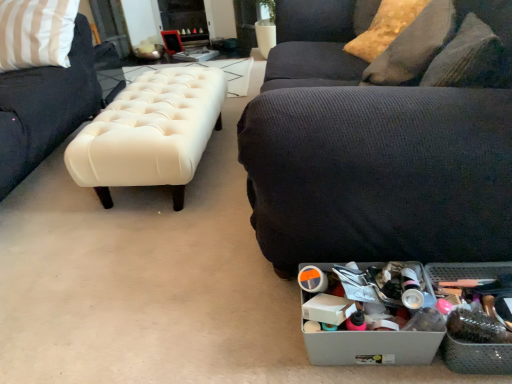
What do you see at coordinates (371, 347) in the screenshot? This screenshot has width=512, height=384. I see `metallic gray storage box at lower right, which is the second storage box in right-to-left order` at bounding box center [371, 347].

In order to click on metallic gray storage box at lower right, which is the second storage box in right-to-left order in this screenshot , I will do `click(371, 347)`.

The image size is (512, 384). Describe the element at coordinates (382, 138) in the screenshot. I see `dark gray textured couch at lower right` at that location.

The image size is (512, 384). I want to click on textured yellow pillow at upper right, which appears as the 2th pillow when viewed from the top, so click(x=414, y=46).

This screenshot has width=512, height=384. I want to click on creamy leather bench at center, so click(x=150, y=133).

Where is `metallic gray storage box at lower right, which is the 2th storage box from left to right`? metallic gray storage box at lower right, which is the 2th storage box from left to right is located at coordinates (477, 357).

Is point (374, 32) farther from camera compared to point (457, 275)?

Yes, it is.

Looking at this image, how distant is shiny gold pillow at upper right, which is the first pillow from top to bottom, from metallic gray storage box at lower right, the 1th storage box when ordered from right to left?

A distance of 4.33 feet exists between shiny gold pillow at upper right, which is the first pillow from top to bottom, and metallic gray storage box at lower right, the 1th storage box when ordered from right to left.

From a real-world perspective, is shiny gold pillow at upper right, which is the first pillow from top to bottom, physically located above or below metallic gray storage box at lower right, which is the 2th storage box from left to right?

shiny gold pillow at upper right, which is the first pillow from top to bottom, is above metallic gray storage box at lower right, which is the 2th storage box from left to right.

In the scene shown: Considering the relative positions of shiny gold pillow at upper right, which is the first pillow from top to bottom, and metallic gray storage box at lower right, which is the 2th storage box from left to right, in the image provided, is shiny gold pillow at upper right, which is the first pillow from top to bottom, behind metallic gray storage box at lower right, which is the 2th storage box from left to right,?

Yes, shiny gold pillow at upper right, which is the first pillow from top to bottom, is further from the viewer.

In the scene shown: How many degrees apart are the facing directions of metallic gray storage box at lower right, which is counted as the first storage box, starting from the left, and creamy leather bench at center?

metallic gray storage box at lower right, which is counted as the first storage box, starting from the left, and creamy leather bench at center are facing 3.21 degrees away from each other.

Is metallic gray storage box at lower right, which is counted as the first storage box, starting from the left, positioned with its back to creamy leather bench at center?

No, creamy leather bench at center is not at the back of metallic gray storage box at lower right, which is counted as the first storage box, starting from the left.

From the image's perspective, count 2nd storage boxs downward from the creamy leather bench at center and point to it. Please provide its 2D coordinates.

[(371, 347)]

Can you confirm if metallic gray storage box at lower right, which is counted as the first storage box, starting from the left, is bigger than creamy leather bench at center?

No.

Is shiny gold pillow at upper right, the second pillow ordered from the bottom, oriented away from dark gray textured couch at lower right?

Yes, shiny gold pillow at upper right, the second pillow ordered from the bottom, is positioned with its back facing dark gray textured couch at lower right.

Where is `studio couch that is under the shiny gold pillow at upper right, which is the first pillow from top to bottom (from a real-world perspective)`? This screenshot has width=512, height=384. studio couch that is under the shiny gold pillow at upper right, which is the first pillow from top to bottom (from a real-world perspective) is located at coordinates (x=382, y=138).

Considering the positions of point (370, 57) and point (378, 113), is point (370, 57) closer or farther from the camera than point (378, 113)?

Point (370, 57) is positioned farther from the camera compared to point (378, 113).

Is dark gray textured couch at lower right aimed at shiny gold pillow at upper right, which is the first pillow from top to bottom?

Yes.

Is dark gray textured couch at lower right not within shiny gold pillow at upper right, which is the first pillow from top to bottom?

dark gray textured couch at lower right lies outside shiny gold pillow at upper right, which is the first pillow from top to bottom,'s area.

From the image's perspective, which one is positioned lower, dark gray textured couch at lower right or shiny gold pillow at upper right, which is the first pillow from top to bottom?

dark gray textured couch at lower right, from the image's perspective.

From the image's perspective, which object appears higher, creamy leather bench at center or shiny gold pillow at upper right, which is the first pillow from top to bottom?

From the image's view, shiny gold pillow at upper right, which is the first pillow from top to bottom, is above.

Consider the image. Considering the sizes of creamy leather bench at center and shiny gold pillow at upper right, which is the first pillow from top to bottom, in the image, is creamy leather bench at center bigger or smaller than shiny gold pillow at upper right, which is the first pillow from top to bottom,?

In the image, creamy leather bench at center appears to be larger than shiny gold pillow at upper right, which is the first pillow from top to bottom.

Who is more distant, creamy leather bench at center or shiny gold pillow at upper right, which is the first pillow from top to bottom?

shiny gold pillow at upper right, which is the first pillow from top to bottom, is behind.

Is metallic gray storage box at lower right, which is counted as the first storage box, starting from the left, in front of or behind shiny gold pillow at upper right, the second pillow ordered from the bottom, in the image?

Clearly, metallic gray storage box at lower right, which is counted as the first storage box, starting from the left, is in front of shiny gold pillow at upper right, the second pillow ordered from the bottom.

Is shiny gold pillow at upper right, which is the first pillow from top to bottom, inside metallic gray storage box at lower right, which is counted as the first storage box, starting from the left?

Definitely not — shiny gold pillow at upper right, which is the first pillow from top to bottom, is not inside metallic gray storage box at lower right, which is counted as the first storage box, starting from the left.

Can you confirm if metallic gray storage box at lower right, which is counted as the first storage box, starting from the left, is positioned to the right of shiny gold pillow at upper right, the second pillow ordered from the bottom?

No.

From the image's perspective, is metallic gray storage box at lower right, which is counted as the first storage box, starting from the left, over shiny gold pillow at upper right, the second pillow ordered from the bottom?

No, from the image's perspective, metallic gray storage box at lower right, which is counted as the first storage box, starting from the left, is not on top of shiny gold pillow at upper right, the second pillow ordered from the bottom.

From the image's perspective, between shiny gold pillow at upper right, which is the first pillow from top to bottom, and textured yellow pillow at upper right, which appears as the 2th pillow when viewed from the top, which one is located above?

shiny gold pillow at upper right, which is the first pillow from top to bottom, is shown above in the image.

Is textured yellow pillow at upper right, which appears as the 2th pillow when viewed from the top, at the back of shiny gold pillow at upper right, which is the first pillow from top to bottom?

Yes, shiny gold pillow at upper right, which is the first pillow from top to bottom, is positioned with its back facing textured yellow pillow at upper right, which appears as the 2th pillow when viewed from the top.

You are a GUI agent. You are given a task and a screenshot of the screen. Output one action in this format:
    pyautogui.click(x=<x>, y=<y>)
    Task: Click on the pillow in front of the shiny gold pillow at upper right, which is the first pillow from top to bottom
    The height and width of the screenshot is (384, 512).
    Given the screenshot: What is the action you would take?
    pyautogui.click(x=414, y=46)

Is point (394, 14) positioned in front of point (424, 40)?

No, it is not.

Locate an element on the screen. This screenshot has height=384, width=512. the 1st storage box below when counting from the shiny gold pillow at upper right, the second pillow ordered from the bottom (from the image's perspective) is located at coordinates (477, 357).

This screenshot has width=512, height=384. Find the location of `table to the left of metallic gray storage box at lower right, which is counted as the first storage box, starting from the left`. table to the left of metallic gray storage box at lower right, which is counted as the first storage box, starting from the left is located at coordinates (150, 133).

Which object lies nearer to the anchor point metallic gray storage box at lower right, the 1th storage box when ordered from right to left, textured yellow pillow at upper right, which appears as the 2th pillow when viewed from the top, or creamy leather bench at center?

textured yellow pillow at upper right, which appears as the 2th pillow when viewed from the top, is positioned closer to the anchor metallic gray storage box at lower right, the 1th storage box when ordered from right to left.

Estimate the real-world distances between objects in this image. Which object is further from dark gray textured couch at lower right, metallic gray storage box at lower right, which is the 2th storage box from left to right, or textured yellow pillow at upper right, which appears as the 1th pillow when ordered from the bottom?

Among the two, metallic gray storage box at lower right, which is the 2th storage box from left to right, is located further to dark gray textured couch at lower right.

From the image, which object appears to be farther from metallic gray storage box at lower right, which is the second storage box in right-to-left order, creamy leather bench at center or metallic gray storage box at lower right, the 1th storage box when ordered from right to left?

creamy leather bench at center is further to metallic gray storage box at lower right, which is the second storage box in right-to-left order.

When comparing their distances from dark gray textured couch at lower right, does textured yellow pillow at upper right, which appears as the 1th pillow when ordered from the bottom, or shiny gold pillow at upper right, the second pillow ordered from the bottom, seem closer?

textured yellow pillow at upper right, which appears as the 1th pillow when ordered from the bottom, is positioned closer to the anchor dark gray textured couch at lower right.

From the image, which object appears to be nearer to metallic gray storage box at lower right, which is the second storage box in right-to-left order, textured yellow pillow at upper right, which appears as the 2th pillow when viewed from the top, or creamy leather bench at center?

textured yellow pillow at upper right, which appears as the 2th pillow when viewed from the top, is positioned closer to the anchor metallic gray storage box at lower right, which is the second storage box in right-to-left order.

Consider the image. From the image, which object appears to be farther from textured yellow pillow at upper right, which appears as the 1th pillow when ordered from the bottom, creamy leather bench at center or shiny gold pillow at upper right, the second pillow ordered from the bottom?

creamy leather bench at center is further to textured yellow pillow at upper right, which appears as the 1th pillow when ordered from the bottom.

Which object lies further to the anchor point metallic gray storage box at lower right, the 1th storage box when ordered from right to left, shiny gold pillow at upper right, which is the first pillow from top to bottom, or metallic gray storage box at lower right, which is counted as the first storage box, starting from the left?

Among the two, shiny gold pillow at upper right, which is the first pillow from top to bottom, is located further to metallic gray storage box at lower right, the 1th storage box when ordered from right to left.

Estimate the real-world distances between objects in this image. Which object is further from dark gray textured couch at lower right, metallic gray storage box at lower right, which is counted as the first storage box, starting from the left, or creamy leather bench at center?

creamy leather bench at center is further to dark gray textured couch at lower right.

Find the location of `studio couch between textured yellow pillow at upper right, which appears as the 2th pillow when viewed from the top, and metallic gray storage box at lower right, which is the second storage box in right-to-left order, in the up-down direction`. studio couch between textured yellow pillow at upper right, which appears as the 2th pillow when viewed from the top, and metallic gray storage box at lower right, which is the second storage box in right-to-left order, in the up-down direction is located at coordinates [382, 138].

The image size is (512, 384). What are the coordinates of `studio couch that lies between textured yellow pillow at upper right, which appears as the 2th pillow when viewed from the top, and metallic gray storage box at lower right, the 1th storage box when ordered from right to left, from top to bottom` in the screenshot? It's located at (382, 138).

The height and width of the screenshot is (384, 512). Identify the location of pillow between shiny gold pillow at upper right, which is the first pillow from top to bottom, and metallic gray storage box at lower right, which is the second storage box in right-to-left order, vertically. (414, 46).

At what (x,y) coordinates should I click in order to perform the action: click on pillow between creamy leather bench at center and shiny gold pillow at upper right, the second pillow ordered from the bottom, in the horizontal direction. Please return your answer as a coordinate pair (x, y). The image size is (512, 384). Looking at the image, I should click on click(414, 46).